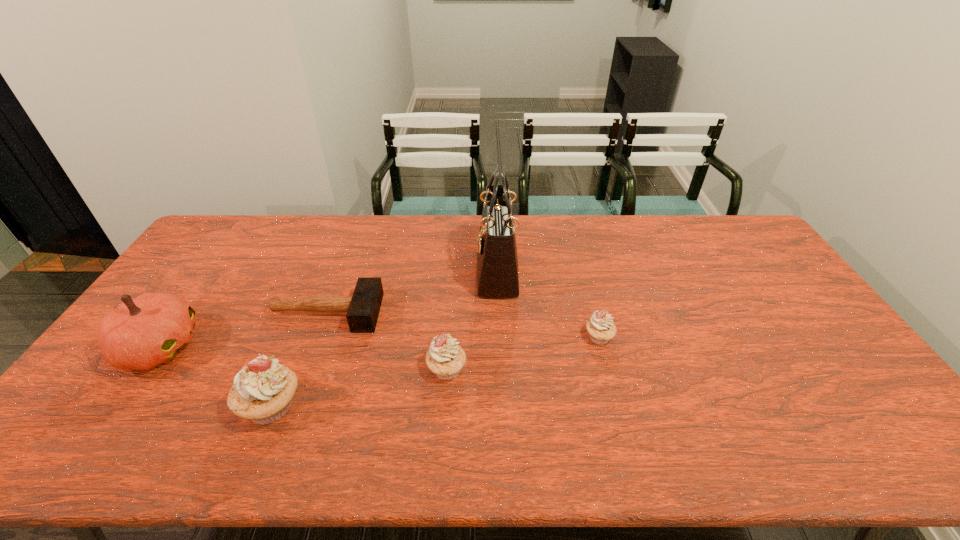
In the image, there is a desktop. Where is `vacant area at the far edge`? The width and height of the screenshot is (960, 540). vacant area at the far edge is located at coordinates (325, 252).

In the image, there is a desktop. Identify the location of vacant space at the near edge. (398, 389).

What are the coordinates of `free space at the left edge of the desktop` in the screenshot? It's located at (199, 282).

Where is `vacant space at the right edge of the desktop`? The image size is (960, 540). vacant space at the right edge of the desktop is located at coordinates (844, 351).

In the image, there is a desktop. What are the coordinates of `vacant region at the far left corner` in the screenshot? It's located at (218, 241).

Where is `free space that is in between the mallet and the fourth tallest object`? The height and width of the screenshot is (540, 960). free space that is in between the mallet and the fourth tallest object is located at coordinates (387, 341).

Image resolution: width=960 pixels, height=540 pixels. What are the coordinates of `vacant space that is in between the fourth tallest object and the rightmost object` in the screenshot? It's located at (523, 353).

Where is `empty space between the fourth object from left to right and the pumpkin`? The width and height of the screenshot is (960, 540). empty space between the fourth object from left to right and the pumpkin is located at coordinates (303, 358).

The image size is (960, 540). I want to click on vacant space that's between the shortest cupcake and the shortest object, so click(463, 325).

Image resolution: width=960 pixels, height=540 pixels. I want to click on blank region between the handbag and the leftmost cupcake, so click(x=384, y=339).